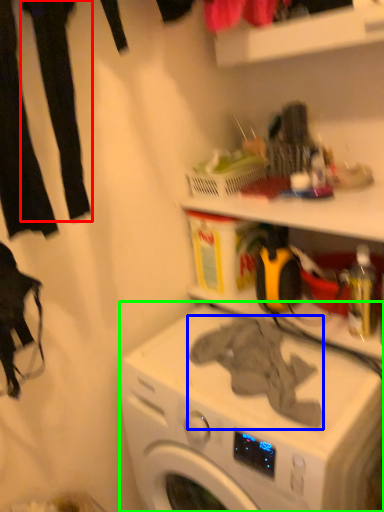
Question: Which object is the farthest from clothing (highlighted by a red box)? Choose among these: clothing (highlighted by a blue box) or washing machine (highlighted by a green box).

Choices:
 (A) clothing
 (B) washing machine

Answer: (B)